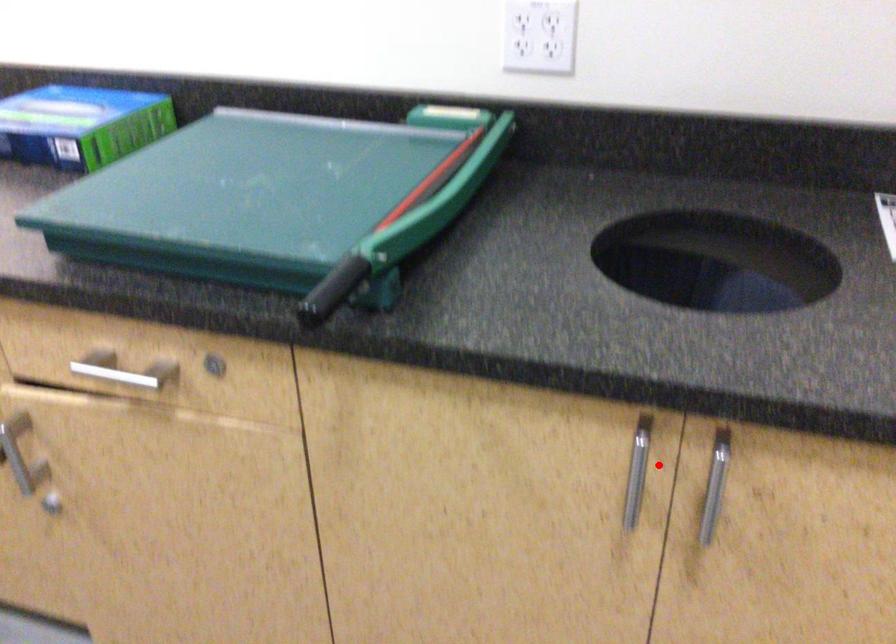
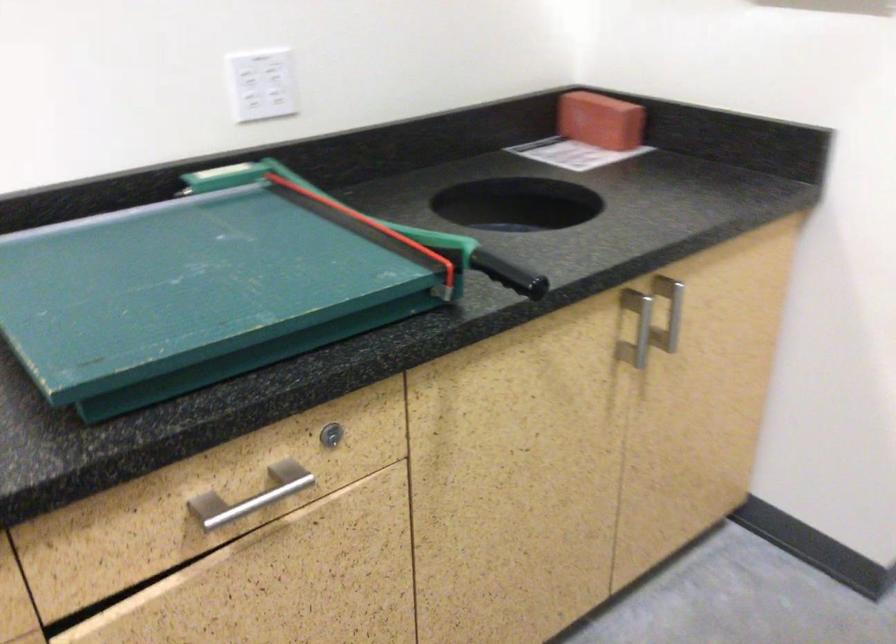
Question: I am providing you with two images of the same scene from different viewpoints. Given a red point in image1, look at the same physical point in image2. Is it:

Choices:
 (A) Closer to the viewpoint
 (B) Farther from the viewpoint

Answer: (B)